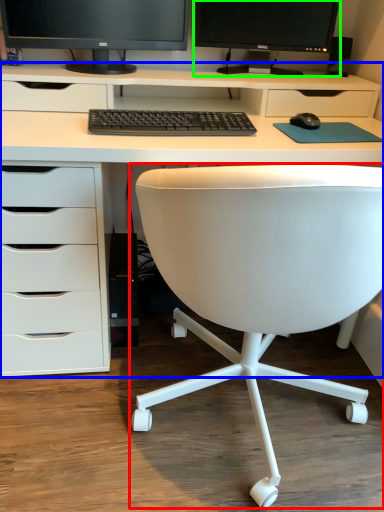
Question: Estimate the real-world distances between objects in this image. Which object is farther from chair (highlighted by a red box), desk (highlighted by a blue box) or computer monitor (highlighted by a green box)?

Choices:
 (A) desk
 (B) computer monitor

Answer: (B)